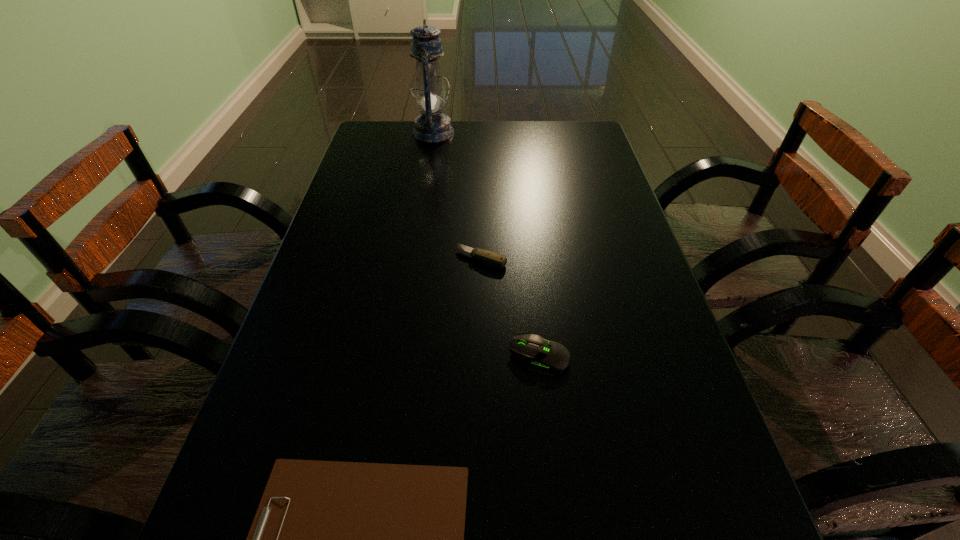
Find the location of a particular element. blank region between the third tallest object and the second nearest object is located at coordinates (511, 308).

This screenshot has height=540, width=960. Identify the location of the closest object to the third tallest object. (545, 357).

Select which object appears as the closest to the lantern. Please provide its 2D coordinates. Your answer should be formatted as a tuple, i.e. [(x, y)], where the tuple contains the x and y coordinates of a point satisfying the conditions above.

[(491, 258)]

Locate an element on the screen. This screenshot has height=540, width=960. free location that satisfies the following two spatial constraints: 1. on the front-facing side of the second nearest object; 2. on the right side of the tallest object is located at coordinates (398, 357).

Locate an element on the screen. vacant region that satisfies the following two spatial constraints: 1. on the front side of the third farthest object; 2. on the left side of the third nearest object is located at coordinates (482, 357).

Locate an element on the screen. free point that satisfies the following two spatial constraints: 1. on the front-facing side of the second farthest object; 2. on the left side of the farthest object is located at coordinates (414, 258).

Locate an element on the screen. The width and height of the screenshot is (960, 540). free location that satisfies the following two spatial constraints: 1. on the front-facing side of the farthest object; 2. on the left side of the computer mouse is located at coordinates (398, 357).

Locate an element on the screen. Image resolution: width=960 pixels, height=540 pixels. vacant area in the image that satisfies the following two spatial constraints: 1. on the front-facing side of the third nearest object; 2. on the right side of the lantern is located at coordinates (414, 258).

Find the location of a particular element. free space that satisfies the following two spatial constraints: 1. on the front-facing side of the farthest object; 2. on the right side of the third farthest object is located at coordinates (398, 357).

Image resolution: width=960 pixels, height=540 pixels. Identify the location of vacant area that satisfies the following two spatial constraints: 1. on the front-facing side of the farthest object; 2. on the left side of the computer mouse. (398, 357).